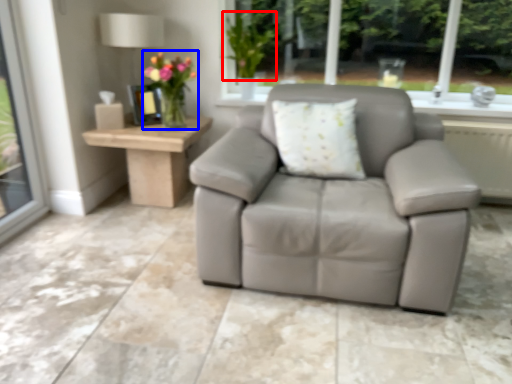
Question: Which point is closer to the camera, plant (highlighted by a red box) or floral arrangement (highlighted by a blue box)?

Choices:
 (A) plant
 (B) floral arrangement

Answer: (B)